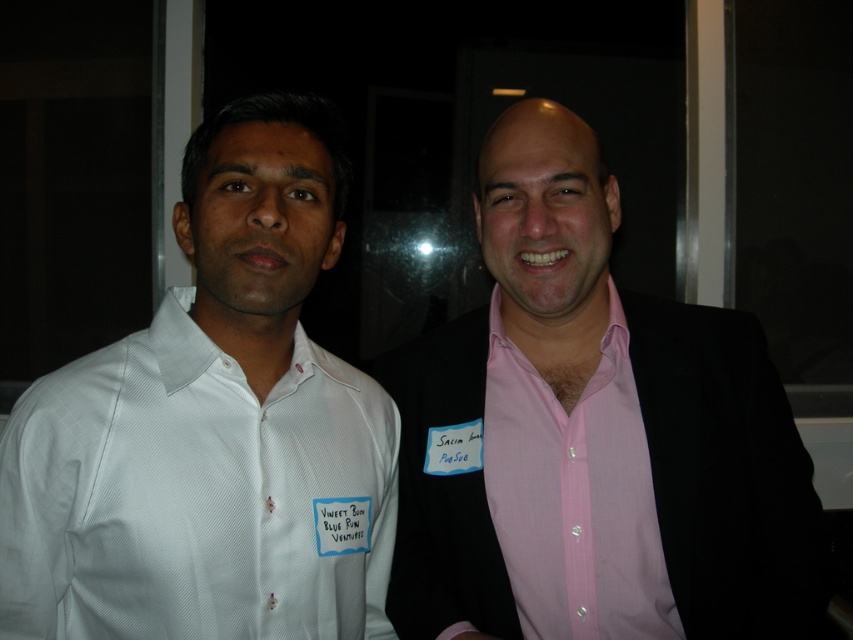
Question: Which point is closer to the camera?

Choices:
 (A) pink smooth shirt at right
 (B) pink satin shirt at center
 (C) white textured shirt at left

Answer: (C)

Question: Does pink satin shirt at center have a greater width compared to pink smooth shirt at right?

Choices:
 (A) yes
 (B) no

Answer: (A)

Question: Among these objects, which one is farthest from the camera?

Choices:
 (A) pink smooth shirt at right
 (B) white textured shirt at left

Answer: (A)

Question: Which point appears closest to the camera in this image?

Choices:
 (A) (526, 458)
 (B) (646, 342)
 (C) (151, 470)

Answer: (C)

Question: Is pink satin shirt at center bigger than pink smooth shirt at right?

Choices:
 (A) no
 (B) yes

Answer: (B)

Question: Is pink satin shirt at center in front of pink smooth shirt at right?

Choices:
 (A) yes
 (B) no

Answer: (A)